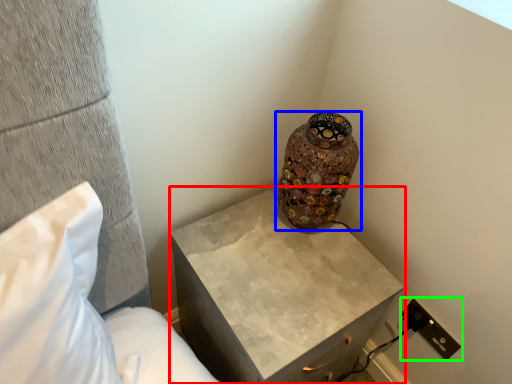
Question: Which is nearer to the nightstand (highlighted by a red box)? vase (highlighted by a blue box) or electric outlet (highlighted by a green box).

Choices:
 (A) vase
 (B) electric outlet

Answer: (A)